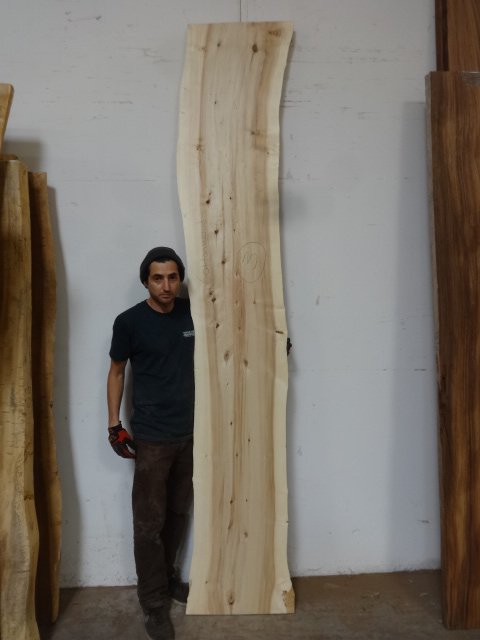
Locate an element on the screen. This screenshot has width=480, height=640. grey seam in wall is located at coordinates (240, 12).